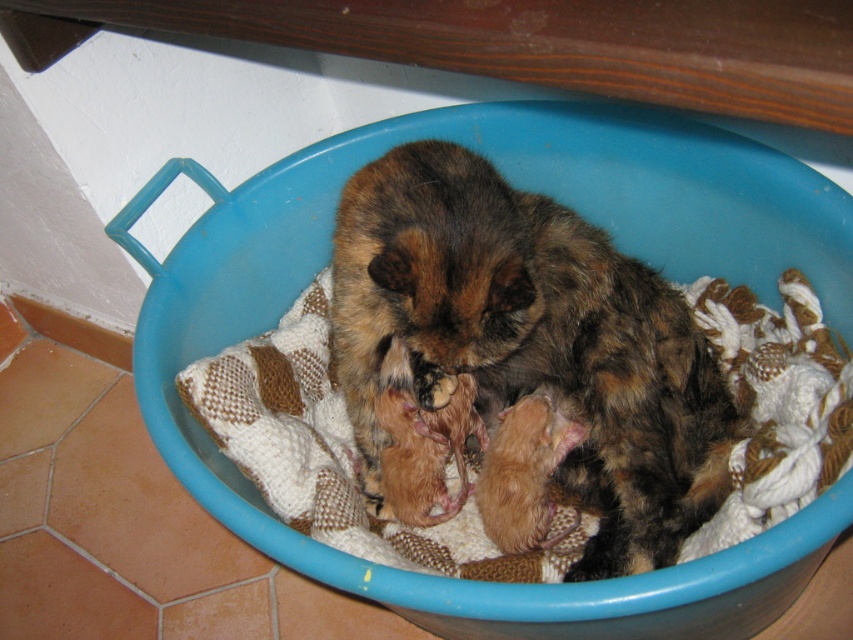
Can you confirm if blue plastic bowl at center is bigger than fluffy brown cat at center?

Yes, blue plastic bowl at center is bigger than fluffy brown cat at center.

Between blue plastic bowl at center and fluffy brown cat at center, which one has less height?

Standing shorter between the two is fluffy brown cat at center.

Which is in front, point (213, 314) or point (390, 276)?

Point (390, 276)

At what (x,y) coordinates should I click in order to perform the action: click on blue plastic bowl at center. Please return your answer as a coordinate pair (x, y). This screenshot has width=853, height=640. Looking at the image, I should click on (589, 218).